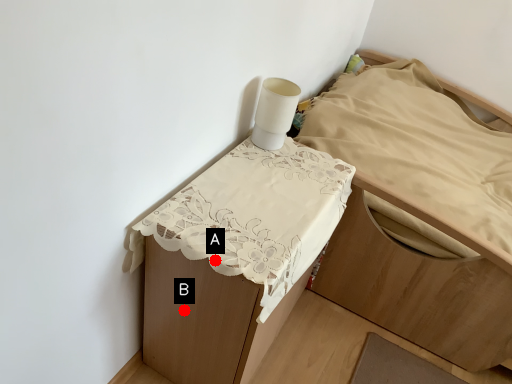
Question: Two points are circled on the image, labeled by A and B beside each circle. Among these points, which one is farthest from the camera?

Choices:
 (A) A is further
 (B) B is further

Answer: (B)